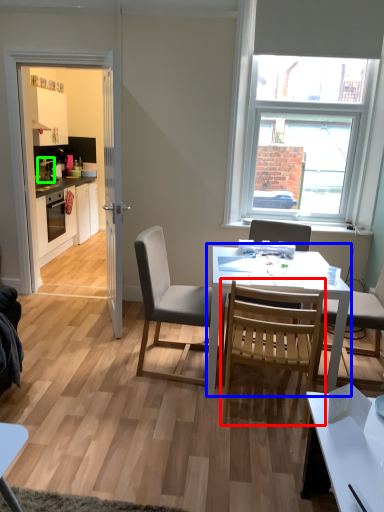
Question: Which object is the farthest from chair (highlighted by a red box)? Choose among these: round table (highlighted by a blue box) or appliance (highlighted by a green box).

Choices:
 (A) round table
 (B) appliance

Answer: (B)